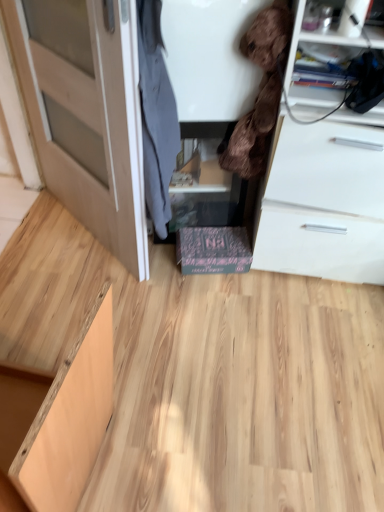
I want to click on vacant space to the right of black cardboard box at center, the first cabinetry from the back, so click(274, 285).